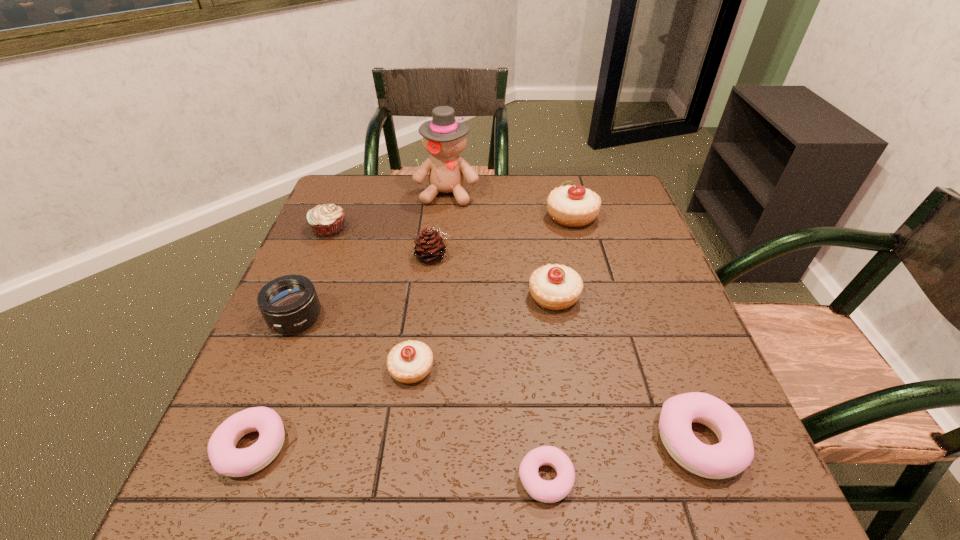
In order to click on the tallest object in this screenshot , I will do coord(444,138).

The height and width of the screenshot is (540, 960). What are the coordinates of `the tallest pastry` in the screenshot? It's located at (573, 206).

I want to click on the farthest beige pastry, so click(x=573, y=206).

Locate an element on the screen. The height and width of the screenshot is (540, 960). pinecone is located at coordinates (430, 247).

Locate an element on the screen. brown pinecone is located at coordinates (430, 247).

You are a GUI agent. You are given a task and a screenshot of the screen. Output one action in this format:
    pyautogui.click(x=<x>, y=<y>)
    Task: Click on the second farthest beige pastry
    This screenshot has width=960, height=540.
    Given the screenshot: What is the action you would take?
    pyautogui.click(x=555, y=287)

Where is `the fifth nearest pastry`? Image resolution: width=960 pixels, height=540 pixels. the fifth nearest pastry is located at coordinates (555, 287).

Find the location of `muffin`. muffin is located at coordinates (327, 220).

Locate an element on the screen. The width and height of the screenshot is (960, 540). telephoto lens is located at coordinates (288, 304).

Find the location of a particular element. the nearest beige pastry is located at coordinates (411, 361).